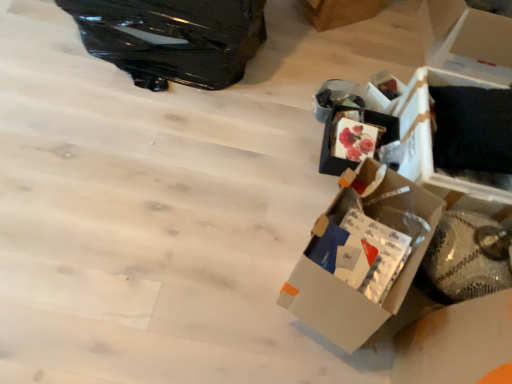
Identify the location of vacant space that is in between glossy black suitcase at upper left and black cardboard box at right, placed as the 1th storage box when sorted from front to back. The height and width of the screenshot is (384, 512). (264, 99).